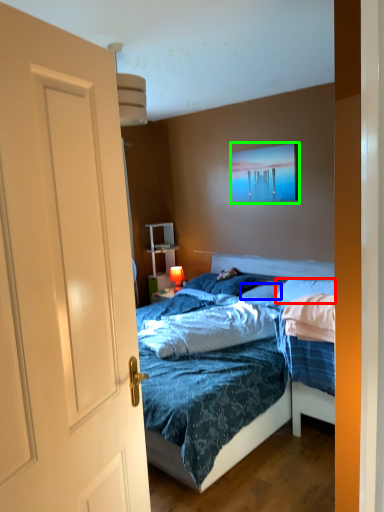
Question: Which is nearer to the pillow (highlighted by a red box)? pillow (highlighted by a blue box) or picture frame (highlighted by a green box).

Choices:
 (A) pillow
 (B) picture frame

Answer: (A)